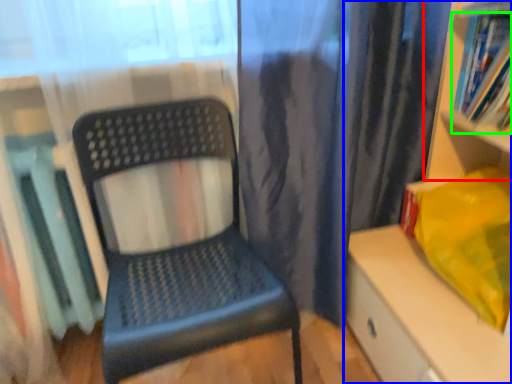
Question: Which is nearer to the shelf (highlighted by a red box)? shelf (highlighted by a blue box) or book (highlighted by a green box).

Choices:
 (A) shelf
 (B) book

Answer: (B)